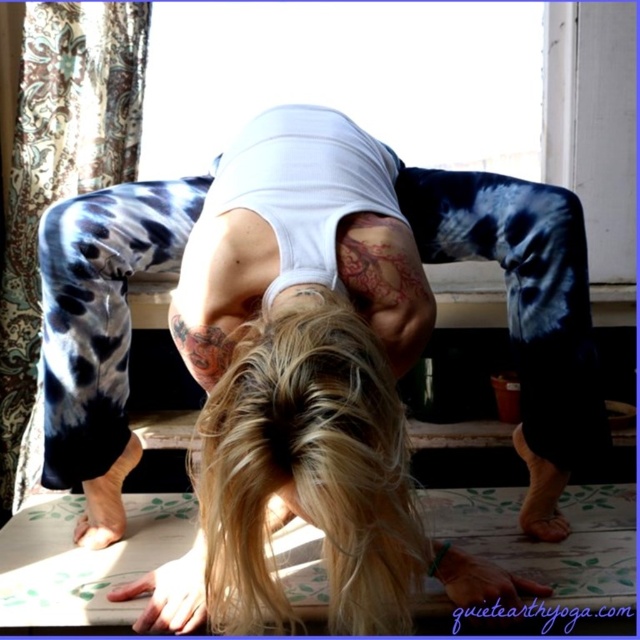
Question: Does tie-dye fabric pants at center have a larger size compared to matte white yoga mat at center?

Choices:
 (A) yes
 (B) no

Answer: (A)

Question: Which object is farther from the camera taking this photo?

Choices:
 (A) tie-dye fabric pants at center
 (B) matte white yoga mat at center

Answer: (B)

Question: Is tie-dye fabric pants at center thinner than matte white yoga mat at center?

Choices:
 (A) yes
 (B) no

Answer: (A)

Question: Which point appears closest to the camera in this image?

Choices:
 (A) (508, 556)
 (B) (387, 337)

Answer: (B)

Question: From the image, what is the correct spatial relationship of tie-dye fabric pants at center in relation to matte white yoga mat at center?

Choices:
 (A) right
 (B) left

Answer: (B)

Question: Which object is farther from the camera taking this photo?

Choices:
 (A) tie-dye fabric pants at center
 (B) matte white yoga mat at center

Answer: (B)